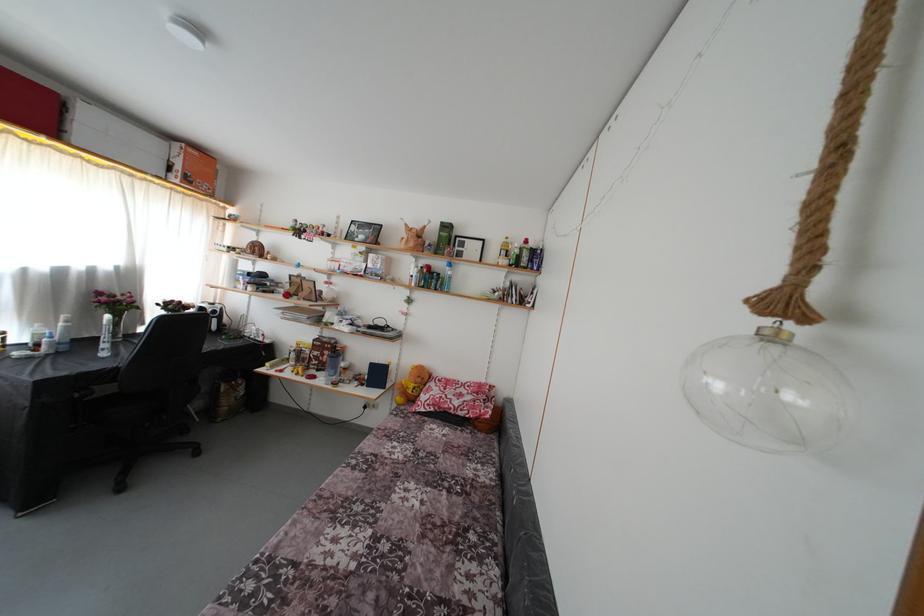
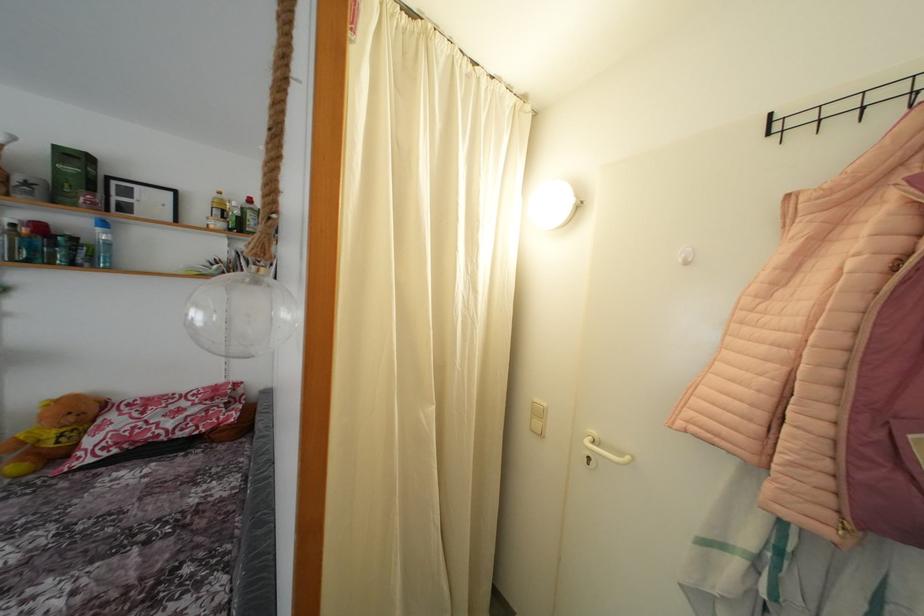
Where in the second image is the point corresponding to (452,233) from the first image?

(80, 163)